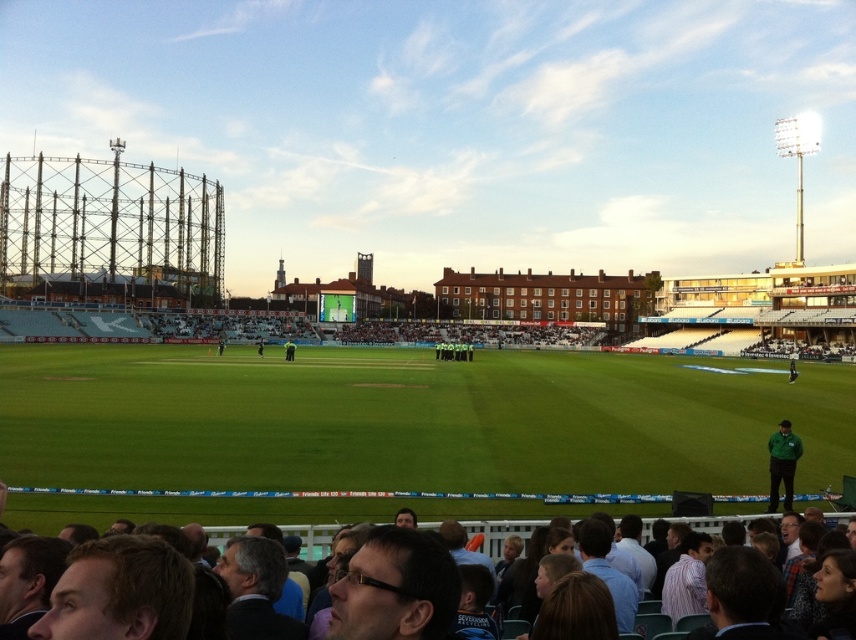
You are a spectator at the cricket match and want to locate the players on the field. Based on the image, where is the green uniform at center in relation to the green grass football field at center?

The green uniform at center is above the green grass football field at center.

You are a photographer standing at the edge of the cricket field. You want to capture a photo that includes both the dark brown leather jacket at lower center and the green fabric jacket at lower right. What is the minimum distance you need to move backward to ensure both jackets are in frame?

To include both the dark brown leather jacket at lower center and the green fabric jacket at lower right in the photo, you need to move back at least 36.04 feet from your current position.

You are a photographer trying to capture a photo of both the dark brown leather jacket at lower center and the green fabric jacket at lower right. Since you want both jackets to be fully visible in the frame, which jacket should you focus on to ensure the other doesn

The dark brown leather jacket at lower center is shorter than the green fabric jacket at lower right. Therefore, you should focus on the green fabric jacket at lower right to ensure the shorter dark brown leather jacket at lower center is fully visible in the frame.